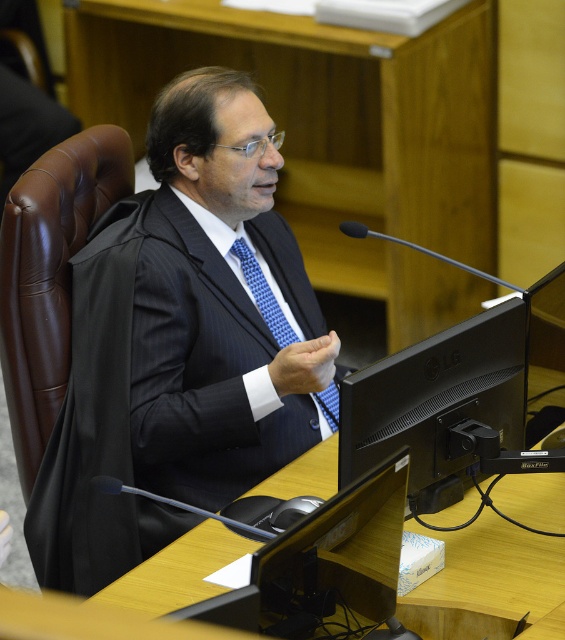
You are an assistant who needs to place a 20 inch wide decorative item on the desk between the black glossy monitor at center and the blue textured tie at center. Will there be enough space for it?

The black glossy monitor at center and blue textured tie at center are 21.20 inches apart from each other. Since the decorative item is 20 inches wide, there is enough space to place it between them.

You are an assistant in the courtroom. You need to place a document on the desk such that it is closer to the speaker than to the microphone. The speaker is at point (444, 468) and the microphone is at point (279, 314). Where should you place the document?

The document should be placed closer to point (444, 468) than to point (279, 314). Since point (444, 468) is in front of point (279, 314), placing it near the speaker ensures it is closer to the speaker and farther from the microphone.